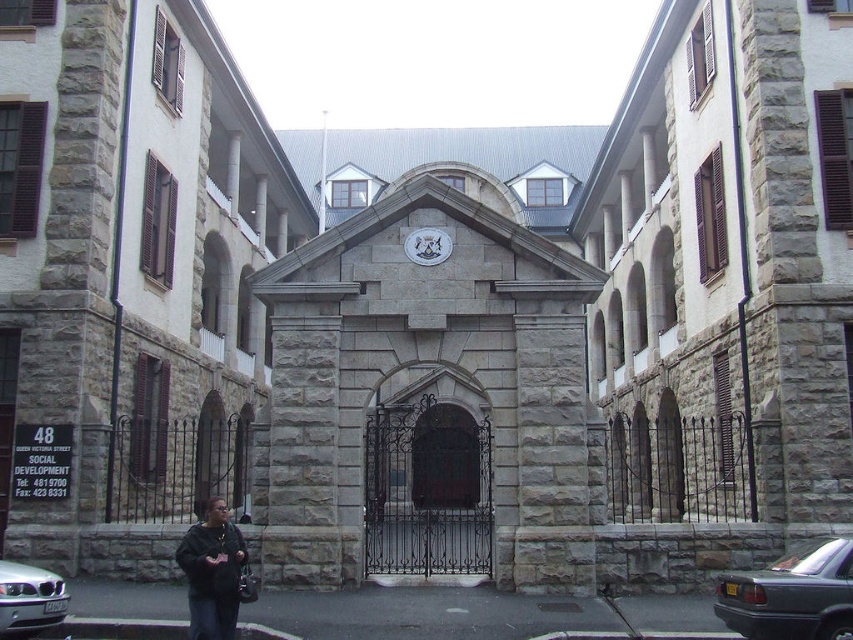
You are standing in front of the historic stone building and notice two items on the ground. You see a dark gray sweater at lower center and a white glossy clock at center. Which item is closer to the ground?

The dark gray sweater at lower center is closer to the ground since it is located below the white glossy clock at center.

You are a visitor arriving at the historic stone building and see the gray stone gate at center and the silver metallic car at lower left. Which object is positioned higher relative to the other?

The gray stone gate at center is above the silver metallic car at lower left, so the gray stone gate at center is positioned higher.

You are standing in front of the historic stone building and want to move from the silver metallic car at lower left to the dark gray sweater at lower center. Is the distance between them sufficient for you to walk directly without needing to detour around any obstacles?

The distance between the dark gray sweater at lower center and the silver metallic car at lower left is 18.64 feet, so yes, there is enough space to walk directly between them without needing to detour around obstacles.